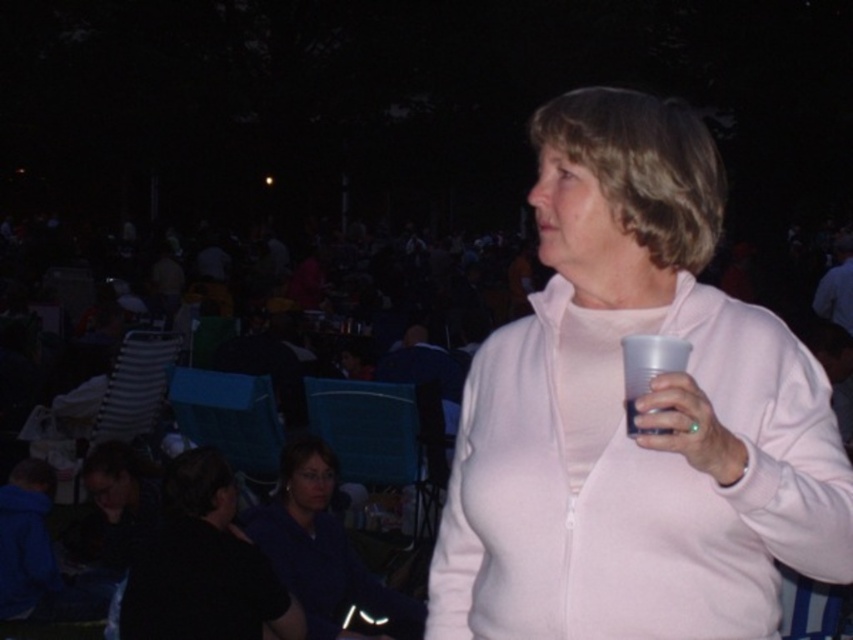
Who is positioned more to the left, matte blue shirt at lower center or translucent plastic cup at right?

From the viewer's perspective, matte blue shirt at lower center appears more on the left side.

Looking at this image, which is below, matte blue shirt at lower center or translucent plastic cup at right?

Positioned lower is matte blue shirt at lower center.

What are the coordinates of `matte blue shirt at lower center` in the screenshot? It's located at (322, 548).

Is pink matte jacket at center further to the viewer compared to black matte shirt at lower left?

No.

Does pink matte jacket at center have a smaller size compared to black matte shirt at lower left?

No, pink matte jacket at center is not smaller than black matte shirt at lower left.

At what (x,y) coordinates should I click in order to perform the action: click on pink matte jacket at center. Please return your answer as a coordinate pair (x, y). This screenshot has width=853, height=640. Looking at the image, I should click on click(637, 413).

Where is `pink matte jacket at center`? pink matte jacket at center is located at coordinates (637, 413).

Which is below, pink matte jacket at center or translucent plastic cup at right?

Result: translucent plastic cup at right is below.

Is pink matte jacket at center below translucent plastic cup at right?

No.

Image resolution: width=853 pixels, height=640 pixels. Identify the location of pink matte jacket at center. (637, 413).

Locate an element on the screen. pink matte jacket at center is located at coordinates (637, 413).